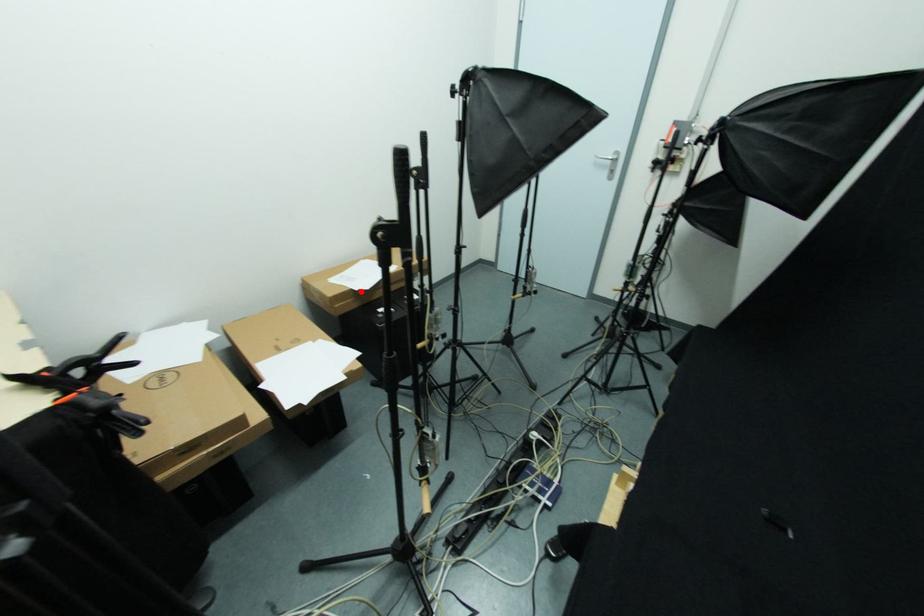
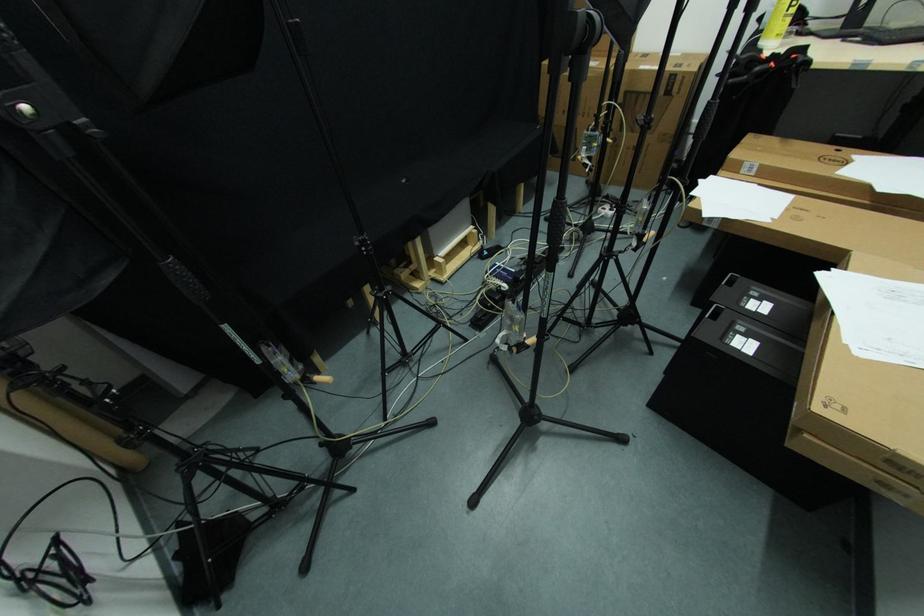
Locate, in the second image, the point that corresponds to the highlighted location in the first image.

(830, 273)